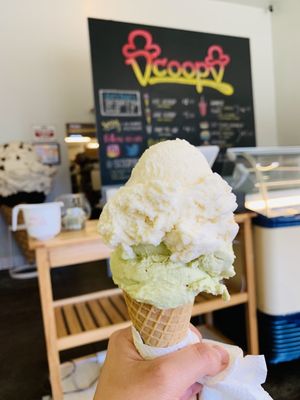
This screenshot has width=300, height=400. Find the location of `stand`. stand is located at coordinates (97, 311).